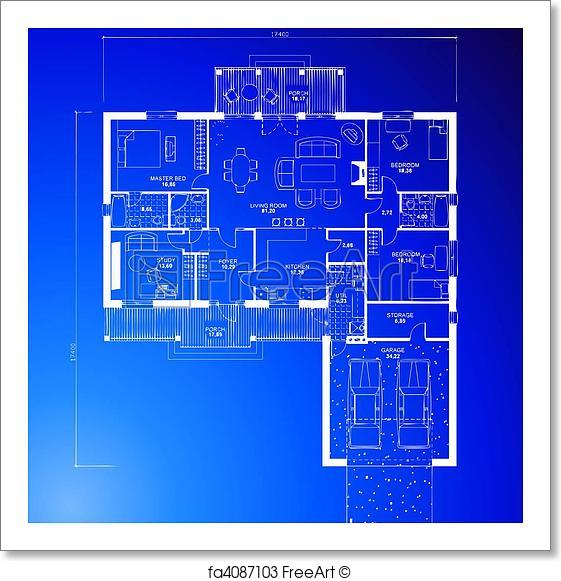
Where is `bedroom`? This screenshot has height=581, width=561. bedroom is located at coordinates point(262,200), point(413,163).